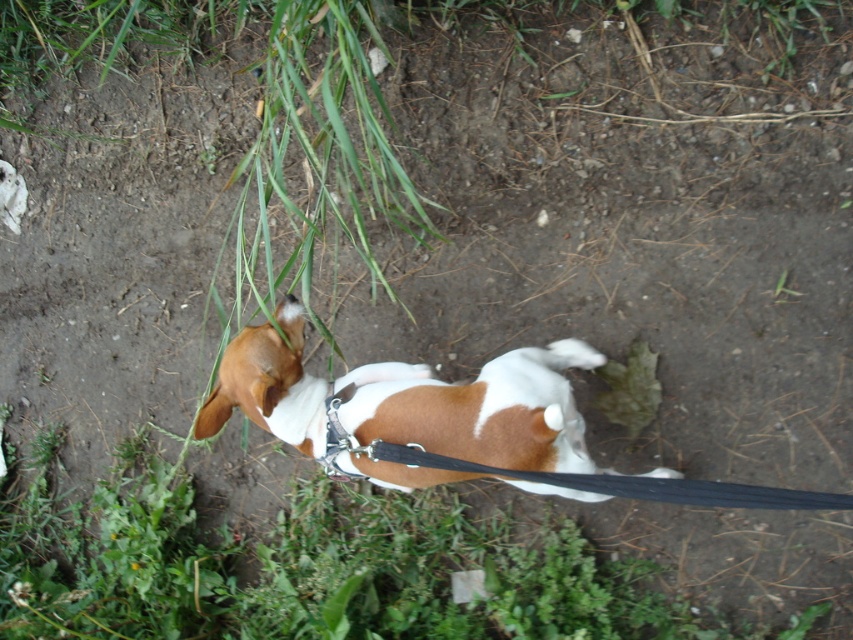
Does brown and white fur at center have a larger size compared to green leafy patch at lower center?

Yes.

Is brown and white fur at center wider than green leafy patch at lower center?

Yes, brown and white fur at center is wider than green leafy patch at lower center.

At what (x,y) coordinates should I click in order to perform the action: click on brown and white fur at center. Please return your answer as a coordinate pair (x, y). The width and height of the screenshot is (853, 640). Looking at the image, I should click on (479, 408).

Between point (486, 397) and point (328, 456), which one is positioned behind?

Point (328, 456)

From the picture: Does brown and white fur at center have a lesser height compared to metallic silver collar at center?

No, brown and white fur at center is not shorter than metallic silver collar at center.

Where is `brown and white fur at center`? The image size is (853, 640). brown and white fur at center is located at coordinates (479, 408).

What are the coordinates of `brown and white fur at center` in the screenshot? It's located at (479, 408).

What do you see at coordinates (630, 388) in the screenshot? I see `green leafy patch at lower center` at bounding box center [630, 388].

Which is more to the left, green leafy patch at lower center or metallic silver collar at center?

From the viewer's perspective, metallic silver collar at center appears more on the left side.

Which is in front, point (630, 381) or point (334, 465)?

Positioned in front is point (334, 465).

Identify the location of green leafy patch at lower center. The width and height of the screenshot is (853, 640). (630, 388).